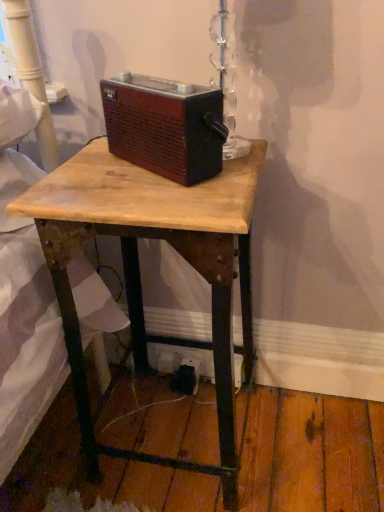
Where is `spots to the right of wooden desk at center`? Image resolution: width=384 pixels, height=512 pixels. spots to the right of wooden desk at center is located at coordinates point(310,442).